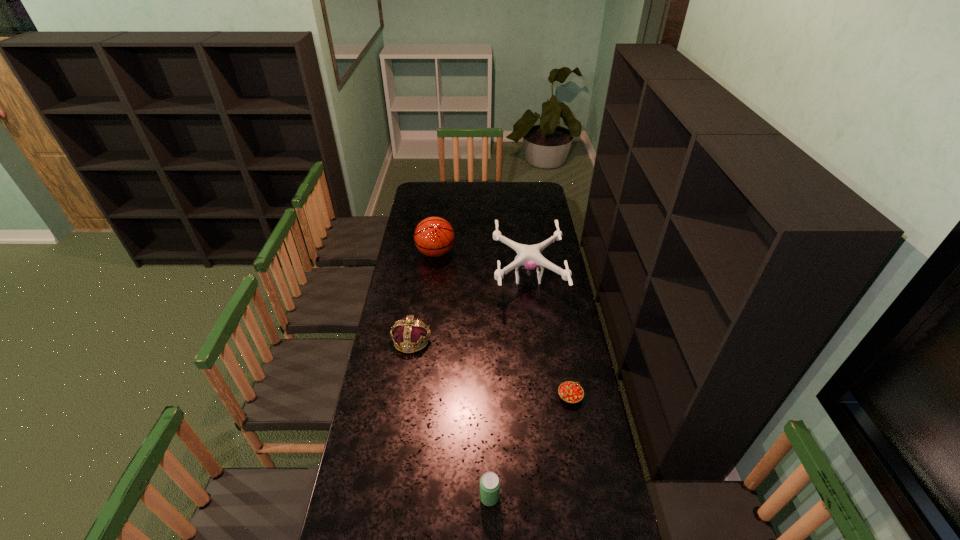
In the image, there is a desktop. At what (x,y) coordinates should I click in order to perform the action: click on vacant space at the right edge. Please return your answer as a coordinate pair (x, y). The width and height of the screenshot is (960, 540). Looking at the image, I should click on (563, 428).

In the image, there is a desktop. Where is `vacant space at the far right corner`? The height and width of the screenshot is (540, 960). vacant space at the far right corner is located at coordinates (534, 185).

I want to click on empty space between the third object from right to left and the third farthest object, so click(450, 418).

Locate an element on the screen. vacant area between the drone and the tallest object is located at coordinates (482, 265).

Where is `free space between the shortest object and the tallest object`? Image resolution: width=960 pixels, height=540 pixels. free space between the shortest object and the tallest object is located at coordinates (503, 325).

At what (x,y) coordinates should I click in order to perform the action: click on free spot between the tallest object and the fourth shortest object. Please return your answer as a coordinate pair (x, y). The image size is (960, 540). Looking at the image, I should click on pos(482,265).

Find the location of a particular element. The height and width of the screenshot is (540, 960). free space between the strawberry and the third object from left to right is located at coordinates (530, 447).

This screenshot has height=540, width=960. I want to click on vacant point located between the basketball and the second tallest object, so click(x=482, y=265).

The width and height of the screenshot is (960, 540). I want to click on vacant area between the basketball and the second tallest object, so click(x=482, y=265).

Locate an element on the screen. This screenshot has height=540, width=960. empty location between the fourth shortest object and the crown is located at coordinates (469, 309).